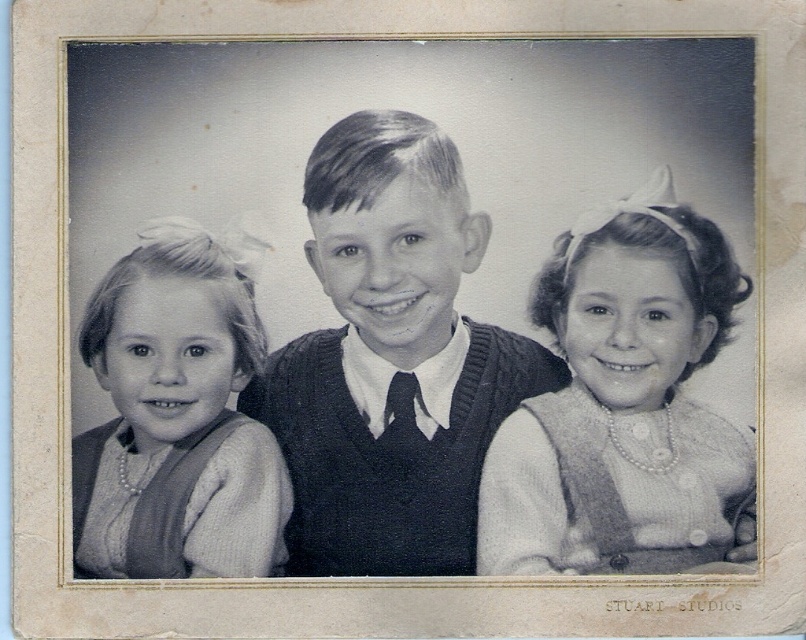
Based on the scene description, which object is bigger between the knitted sweater at center and the black silk tie at center?

The knitted sweater at center is larger than the black silk tie at center according to the description.